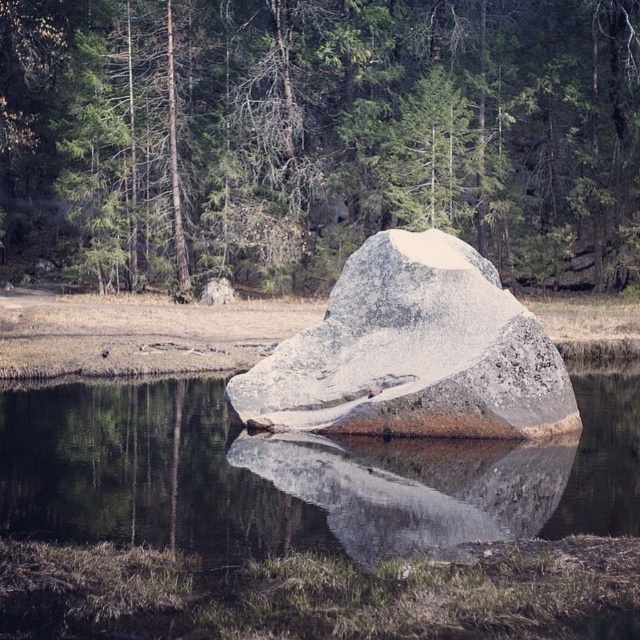
Question: Can you confirm if green textured rock at center is positioned below clear water at center?

Choices:
 (A) no
 (B) yes

Answer: (A)

Question: Which object is positioned farthest from the smooth gray rock at center?

Choices:
 (A) green textured rock at center
 (B) clear water at center

Answer: (A)

Question: Considering the real-world distances, which object is farthest from the green textured rock at center?

Choices:
 (A) clear water at center
 (B) granite rock at center
 (C) smooth gray rock at center

Answer: (C)

Question: Which point is closer to the camera taking this photo?

Choices:
 (A) (608, 22)
 (B) (368, 509)
 (C) (291, 413)

Answer: (B)

Question: Does green textured rock at center appear under smooth gray rock at center?

Choices:
 (A) yes
 (B) no

Answer: (B)

Question: In this image, where is green textured rock at center located relative to smooth gray rock at center?

Choices:
 (A) right
 (B) left

Answer: (B)